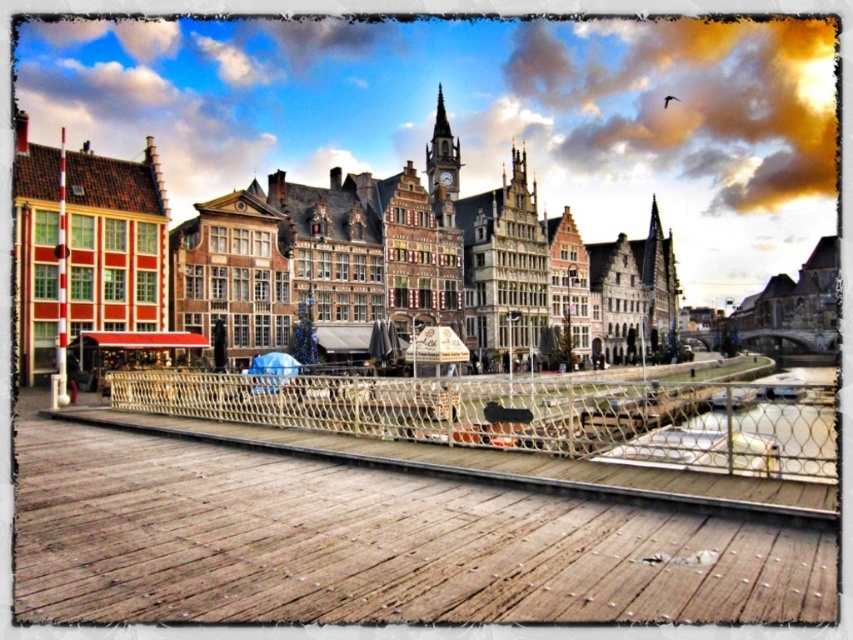
Can you confirm if weathered wood dock at lower center is positioned to the left of metallic mesh rail at center?

Indeed, weathered wood dock at lower center is positioned on the left side of metallic mesh rail at center.

From the picture: Can you confirm if weathered wood dock at lower center is smaller than metallic mesh rail at center?

Correct, weathered wood dock at lower center occupies less space than metallic mesh rail at center.

Between point (653, 504) and point (589, 422), which one is positioned in front?

Point (653, 504) is more forward.

Where is `weathered wood dock at lower center`? Image resolution: width=853 pixels, height=640 pixels. weathered wood dock at lower center is located at coordinates tap(375, 544).